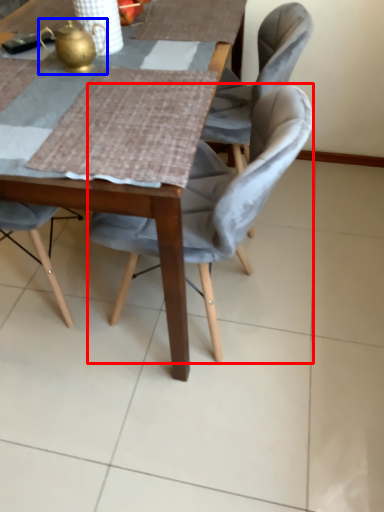
Question: Which object is further to the camera taking this photo, chair (highlighted by a red box) or tea pot (highlighted by a blue box)?

Choices:
 (A) chair
 (B) tea pot

Answer: (B)